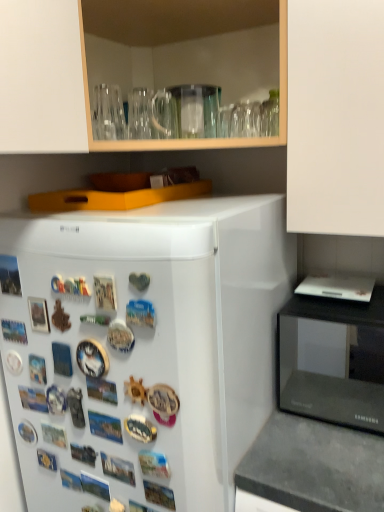
Question: Does dark gray concrete counter top at lower right come in front of black glossy microwave at right?

Choices:
 (A) yes
 (B) no

Answer: (A)

Question: Considering the relative sizes of dark gray concrete counter top at lower right and black glossy microwave at right in the image provided, is dark gray concrete counter top at lower right wider than black glossy microwave at right?

Choices:
 (A) yes
 (B) no

Answer: (A)

Question: From the image's perspective, is dark gray concrete counter top at lower right over black glossy microwave at right?

Choices:
 (A) yes
 (B) no

Answer: (B)

Question: Considering the relative positions of dark gray concrete counter top at lower right and black glossy microwave at right in the image provided, is dark gray concrete counter top at lower right behind black glossy microwave at right?

Choices:
 (A) yes
 (B) no

Answer: (B)

Question: Is dark gray concrete counter top at lower right looking in the opposite direction of black glossy microwave at right?

Choices:
 (A) no
 (B) yes

Answer: (A)

Question: From the image's perspective, is dark gray concrete counter top at lower right under black glossy microwave at right?

Choices:
 (A) no
 (B) yes

Answer: (B)

Question: Is black glossy microwave at right closer to the viewer compared to white glossy refrigerator at left?

Choices:
 (A) no
 (B) yes

Answer: (A)

Question: Is black glossy microwave at right thinner than white glossy refrigerator at left?

Choices:
 (A) no
 (B) yes

Answer: (B)

Question: Is black glossy microwave at right bigger than white glossy refrigerator at left?

Choices:
 (A) no
 (B) yes

Answer: (A)

Question: From a real-world perspective, is black glossy microwave at right positioned under white glossy refrigerator at left based on gravity?

Choices:
 (A) no
 (B) yes

Answer: (A)

Question: Considering the relative positions of black glossy microwave at right and white glossy refrigerator at left in the image provided, is black glossy microwave at right behind white glossy refrigerator at left?

Choices:
 (A) no
 (B) yes

Answer: (B)

Question: Is black glossy microwave at right at the right side of white glossy refrigerator at left?

Choices:
 (A) yes
 (B) no

Answer: (A)

Question: Does dark gray concrete counter top at lower right have a greater width compared to white glossy refrigerator at left?

Choices:
 (A) yes
 (B) no

Answer: (B)